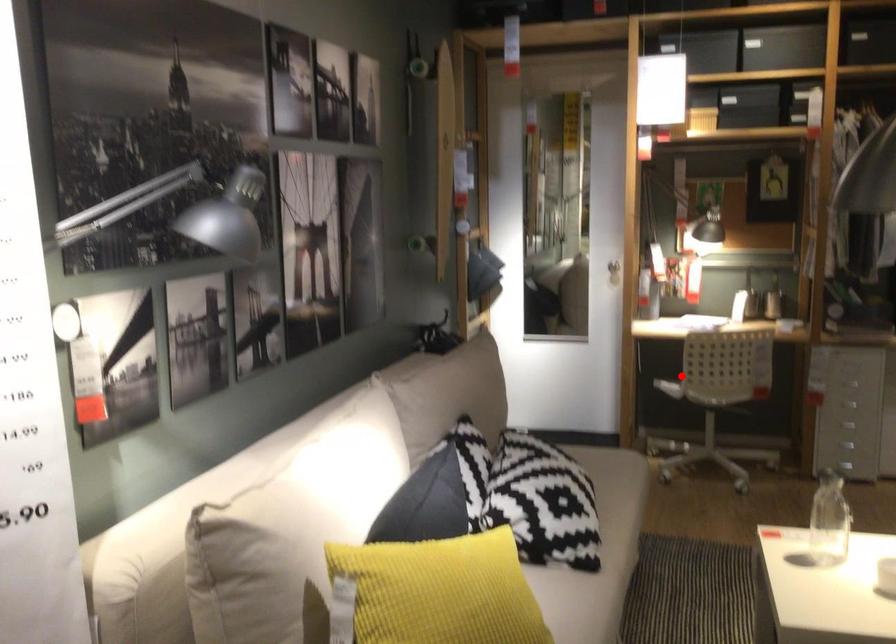
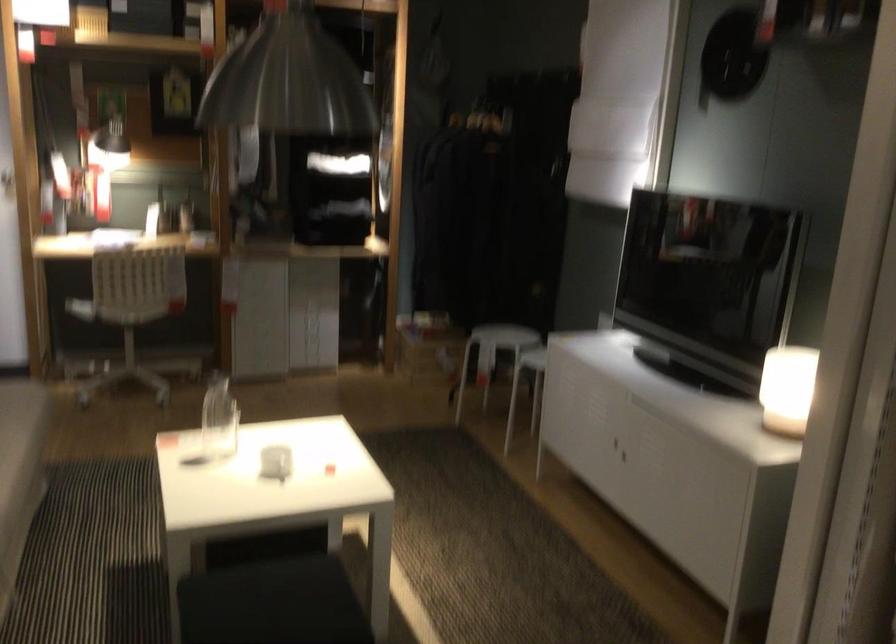
Question: I am providing you with two images of the same scene from different viewpoints. Given a red point in image1, look at the same physical point in image2. Is it:

Choices:
 (A) Closer to the viewpoint
 (B) Farther from the viewpoint

Answer: (A)